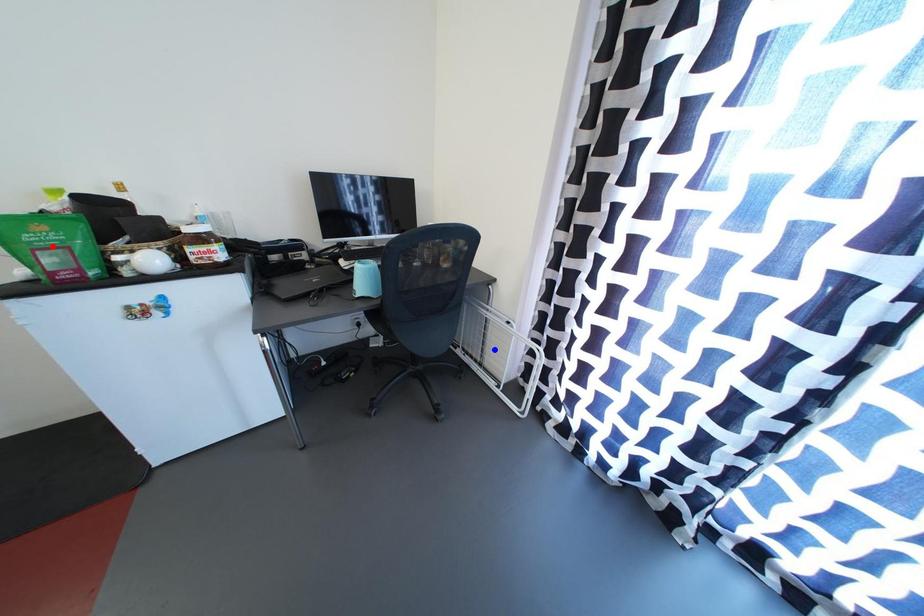
Question: Two points are marked on the image. Which point is closer to the camera?

Choices:
 (A) Blue point is closer.
 (B) Red point is closer.

Answer: (B)